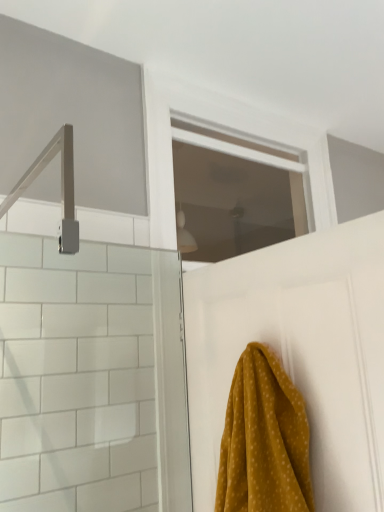
Question: Considering the relative sizes of white matte door at upper center and transparent glass window at center in the image provided, is white matte door at upper center smaller than transparent glass window at center?

Choices:
 (A) yes
 (B) no

Answer: (B)

Question: Can you confirm if white matte door at upper center is wider than transparent glass window at center?

Choices:
 (A) yes
 (B) no

Answer: (A)

Question: Does white matte door at upper center contain transparent glass window at center?

Choices:
 (A) no
 (B) yes

Answer: (B)

Question: Is white matte door at upper center positioned with its back to transparent glass window at center?

Choices:
 (A) yes
 (B) no

Answer: (A)

Question: Can you confirm if white matte door at upper center is thinner than transparent glass window at center?

Choices:
 (A) no
 (B) yes

Answer: (A)

Question: Is white matte door at upper center bigger or smaller than mustard yellow fabric at lower right?

Choices:
 (A) small
 (B) big

Answer: (B)

Question: Does point pos(188,330) appear closer or farther from the camera than point pos(311,485)?

Choices:
 (A) closer
 (B) farther

Answer: (B)

Question: From a real-world perspective, relative to mustard yellow fabric at lower right, is white matte door at upper center vertically above or below?

Choices:
 (A) above
 (B) below

Answer: (A)

Question: Is white matte door at upper center inside the boundaries of mustard yellow fabric at lower right, or outside?

Choices:
 (A) outside
 (B) inside

Answer: (A)

Question: Based on their positions, is mustard yellow fabric at lower right located to the left or right of white matte door at upper center?

Choices:
 (A) left
 (B) right

Answer: (A)

Question: Choose the correct answer: Is mustard yellow fabric at lower right inside white matte door at upper center or outside it?

Choices:
 (A) inside
 (B) outside

Answer: (B)

Question: Looking at their shapes, would you say mustard yellow fabric at lower right is wider or thinner than white matte door at upper center?

Choices:
 (A) thin
 (B) wide

Answer: (B)

Question: Does point (296, 452) appear closer or farther from the camera than point (380, 352)?

Choices:
 (A) closer
 (B) farther

Answer: (B)

Question: Considering the positions of white matte door at upper center and transparent glass window at center in the image, is white matte door at upper center wider or thinner than transparent glass window at center?

Choices:
 (A) thin
 (B) wide

Answer: (B)

Question: Would you say white matte door at upper center is to the left or to the right of transparent glass window at center in the picture?

Choices:
 (A) right
 (B) left

Answer: (A)